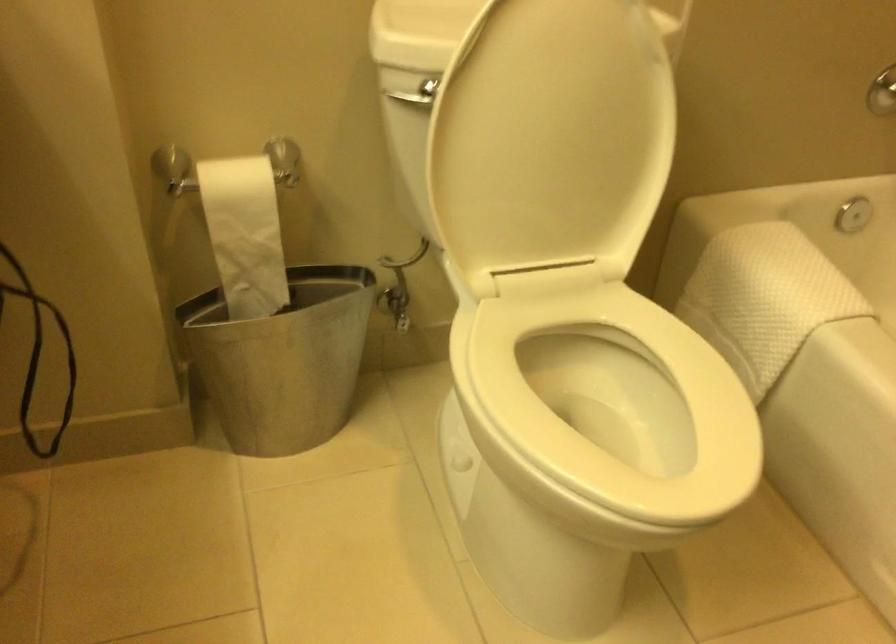
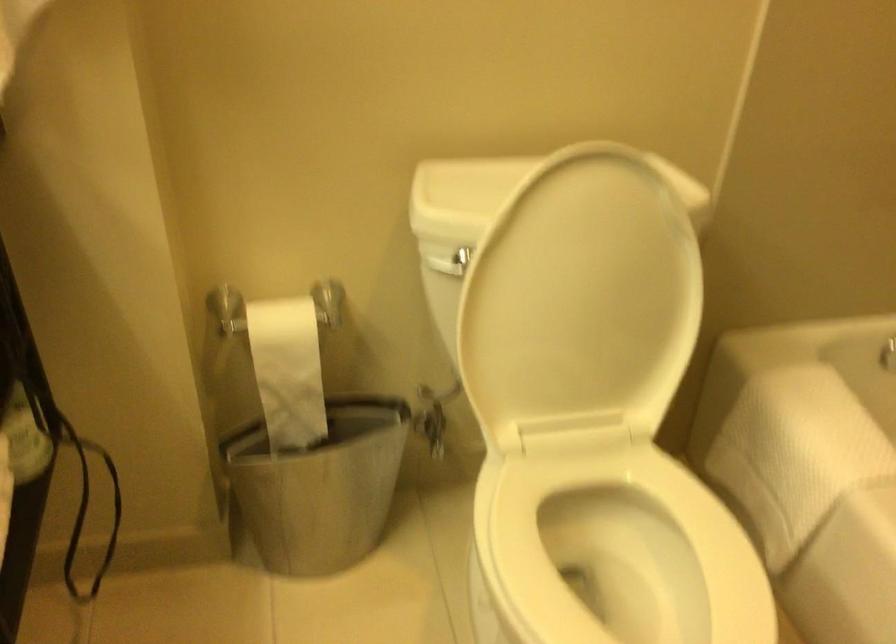
Question: The camera is either moving clockwise (left) or counter-clockwise (right) around the object. The first image is from the beginning of the video and the second image is from the end. Is the camera moving left or right when shooting the video?

Choices:
 (A) Left
 (B) Right

Answer: (B)